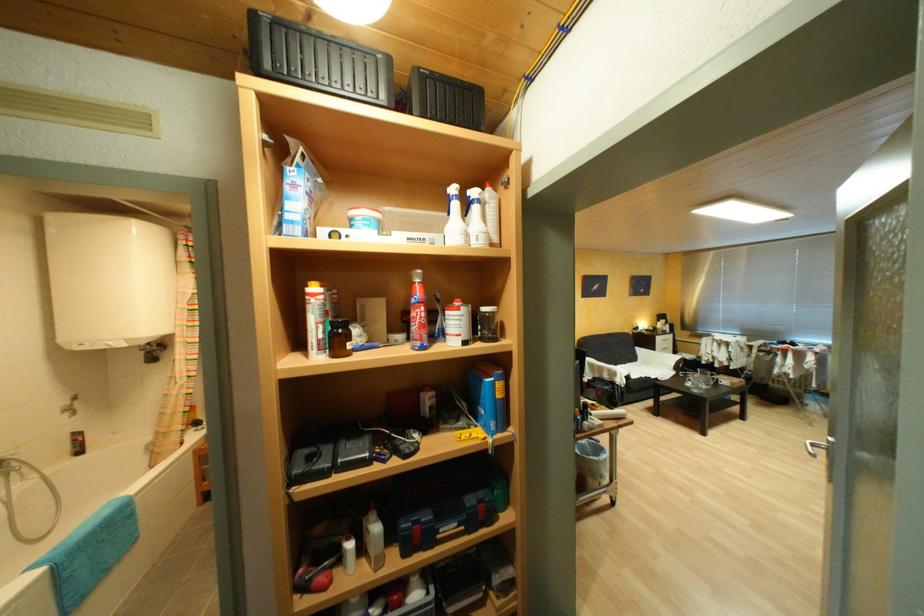
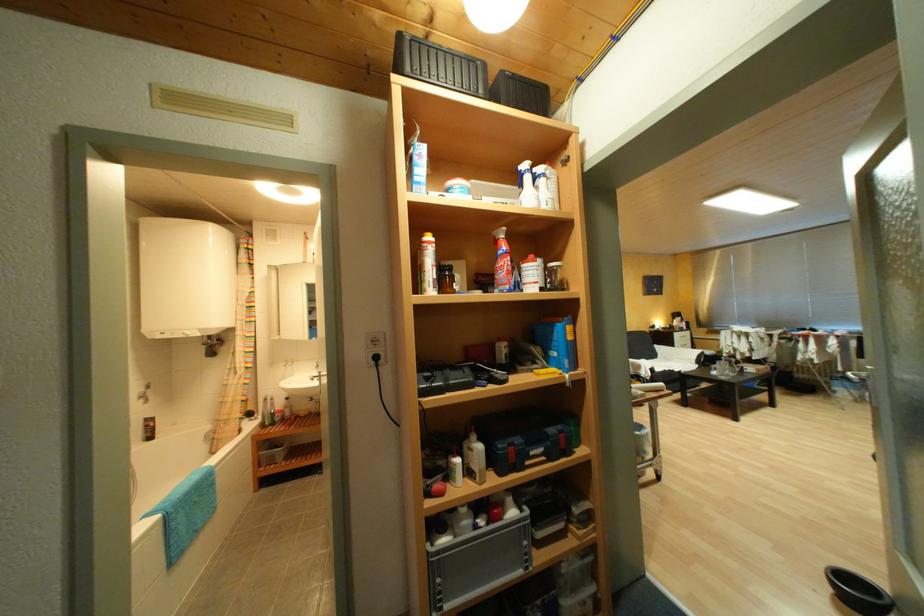
Question: The images are taken continuously from a first-person perspective. In which direction is your viewpoint rotating?

Choices:
 (A) Left
 (B) Right
 (C) Up
 (D) Down

Answer: (C)